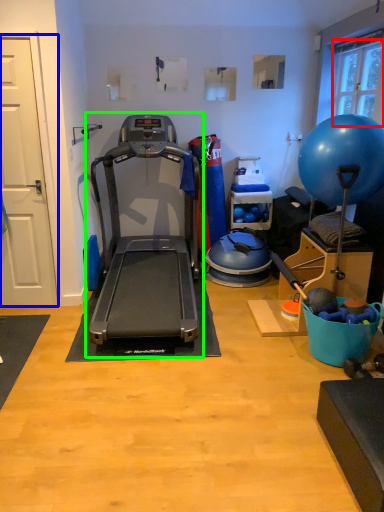
Question: Considering the real-world distances, which object is farthest from window screen (highlighted by a red box)? door (highlighted by a blue box) or treadmill (highlighted by a green box)?

Choices:
 (A) door
 (B) treadmill

Answer: (A)